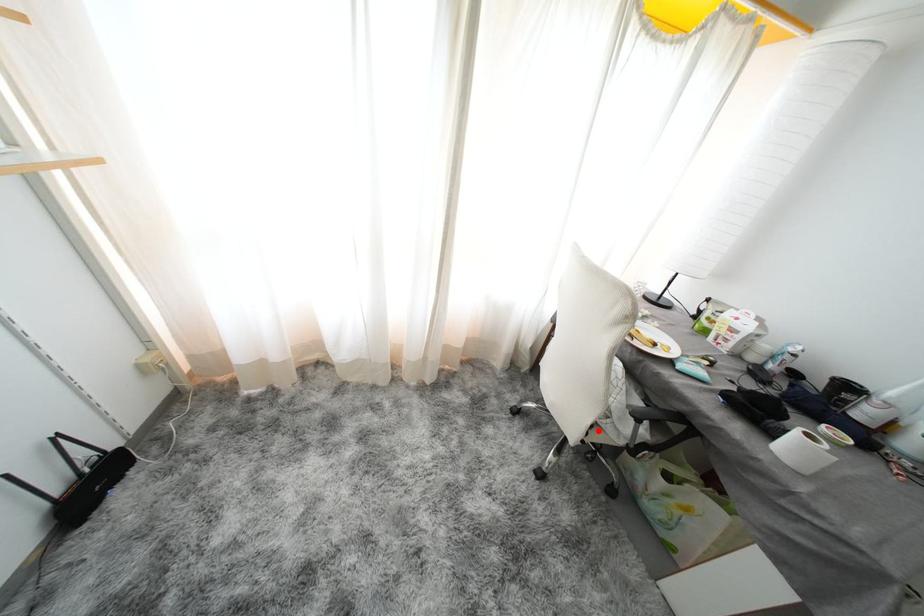
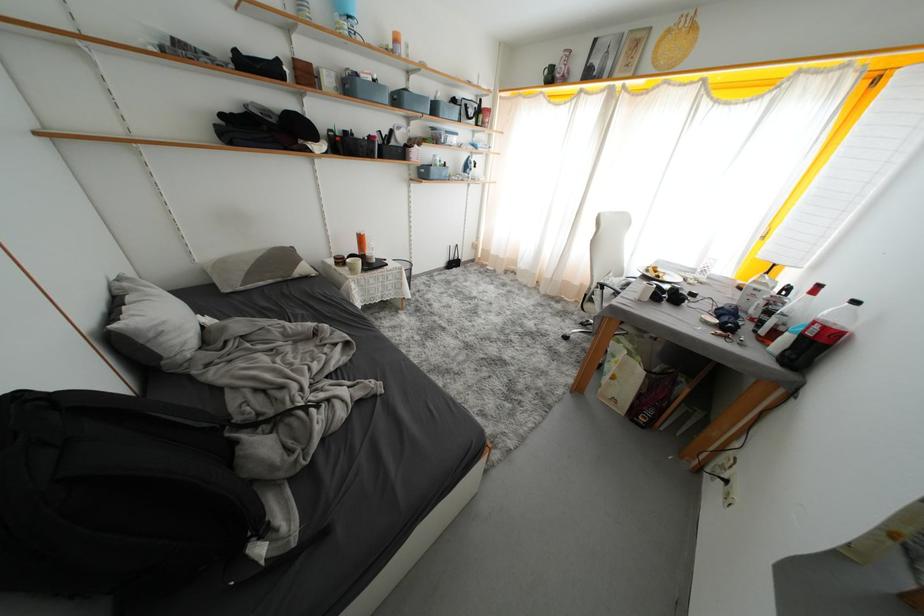
Question: A red point is marked in image1. In image2, is the corresponding 3D point closer to the camera or farther? Reply with the corresponding letter.

Choices:
 (A) The corresponding 3D point is closer.
 (B) The corresponding 3D point is farther.

Answer: (A)